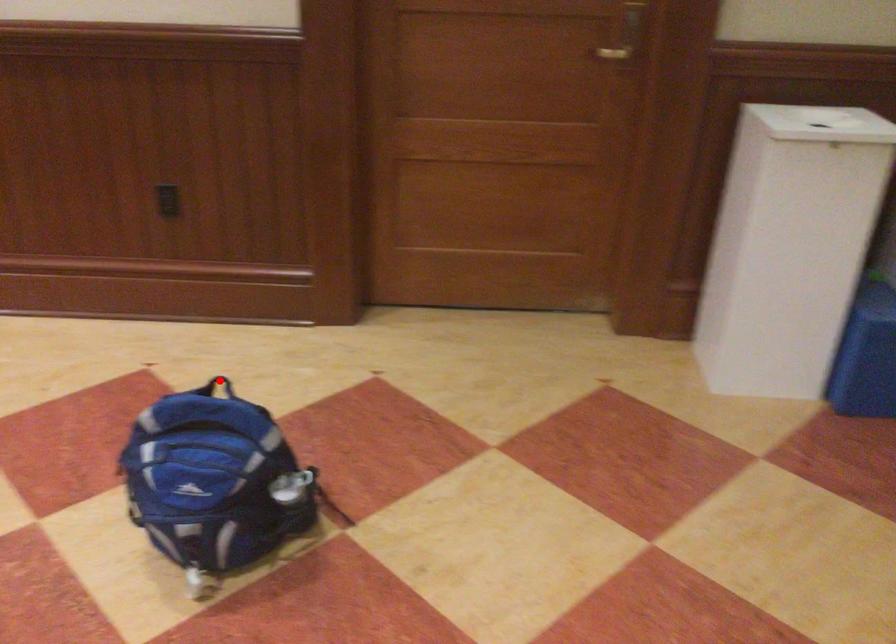
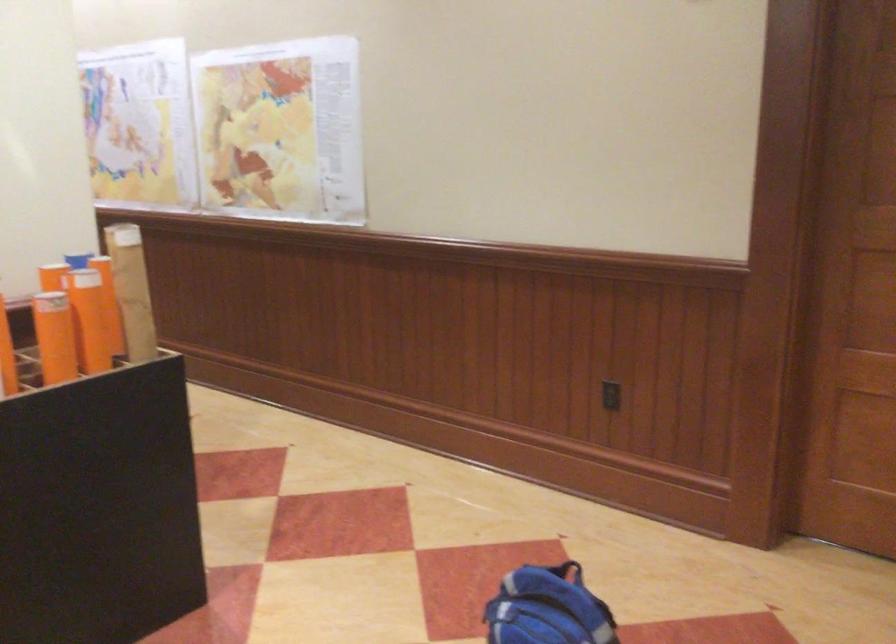
Question: I am providing you with two images of the same scene from different viewpoints. Given a red point in image1, look at the same physical point in image2. Is it:

Choices:
 (A) Closer to the viewpoint
 (B) Farther from the viewpoint

Answer: (B)